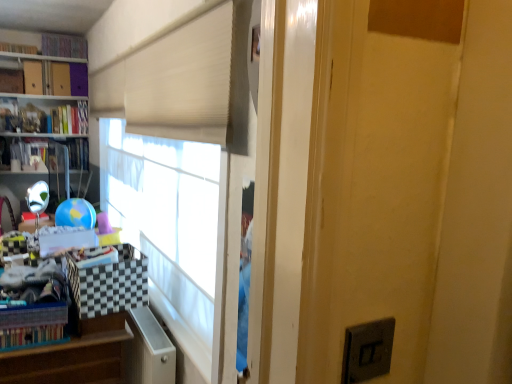
Identify the location of free space above white plastic file cabinet at lower left (from a real-world perspective). (141, 321).